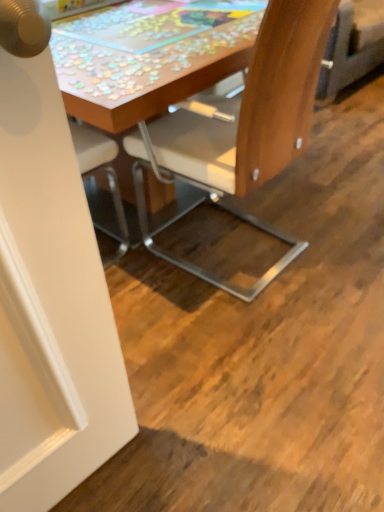
Find the location of `free area below wooden chair at center (from a real-world perspective)`. free area below wooden chair at center (from a real-world perspective) is located at coordinates (263, 258).